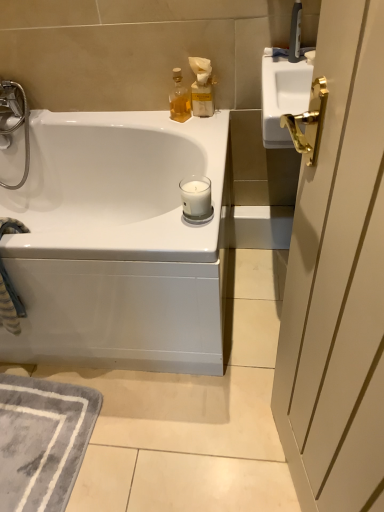
Where is `free space in front of translucent glass bottle at upper center`? free space in front of translucent glass bottle at upper center is located at coordinates (195, 133).